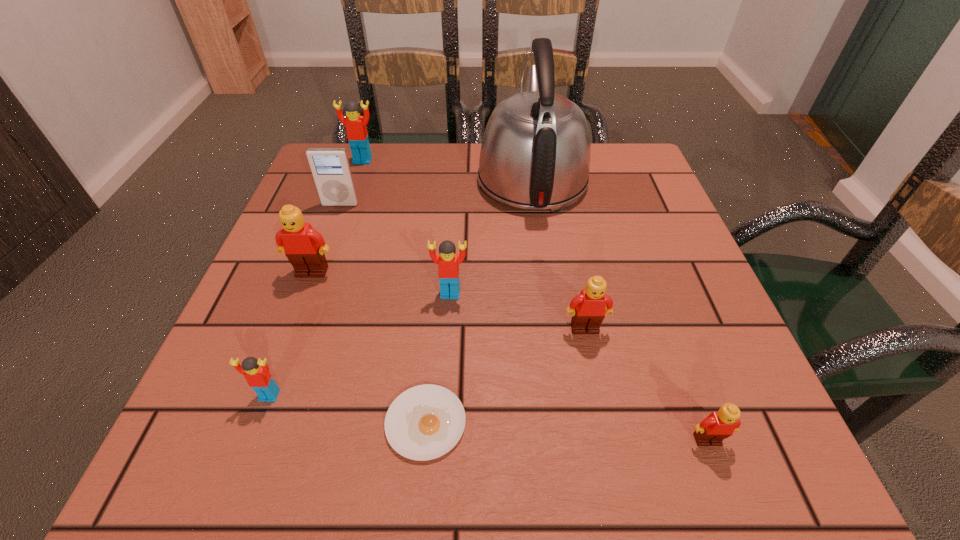
Identify the location of the tallest object. The image size is (960, 540). (535, 154).

Find the location of a particular element. This screenshot has height=540, width=960. gray kettle is located at coordinates (535, 154).

You are a GUI agent. You are given a task and a screenshot of the screen. Output one action in this format:
    pyautogui.click(x=<x>, y=<y>)
    Task: Click on the biggest red Lego
    This screenshot has height=540, width=960.
    Given the screenshot: What is the action you would take?
    [357, 135]

I want to click on the farthest red Lego, so 357,135.

The image size is (960, 540). In order to click on the biggest brown Lego in this screenshot , I will do `click(304, 247)`.

Locate an element on the screen. the fifth nearest Lego is located at coordinates (304, 247).

Find the location of a particular element. The height and width of the screenshot is (540, 960). iPod is located at coordinates (330, 167).

The width and height of the screenshot is (960, 540). I want to click on the fifth farthest object, so click(x=448, y=262).

This screenshot has height=540, width=960. I want to click on the second farthest red Lego, so click(448, 262).

Identify the location of the second farthest brown Lego. This screenshot has height=540, width=960. (589, 308).